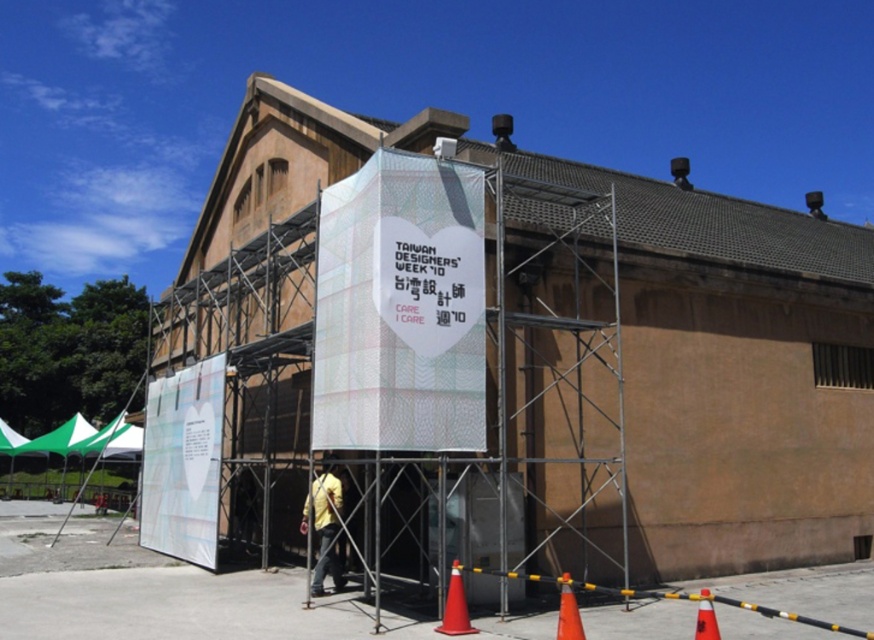
You are a pedestrian walking towards the entrance of the building. You see an orange plastic cone at lower center and an orange matte cone at lower right. Which cone is positioned to the left of the other?

A: The orange plastic cone at lower center is positioned to the left of the orange matte cone at lower right.

You are standing in front of the building and looking at the two points marked on the scaffolding. Which point is closer to you, point (387, 372) or point (327, 481)?

Point (387, 372) is in front of point (327, 481), so it is closer to you.

You are standing at a distance from the large beige building under renovation. There is a point marked at coordinates point (392, 241). Can you estimate how far you are from that point?

The point (392, 241) is 32.22 feet away from the viewer.